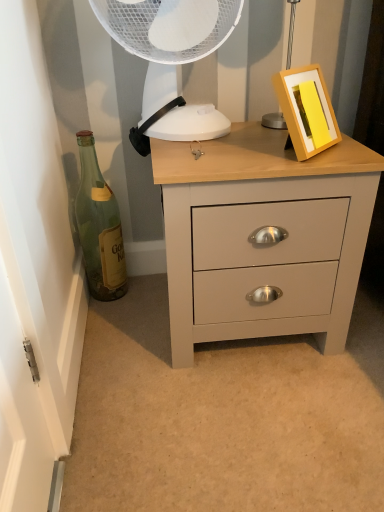
Describe the element at coordinates (259, 227) in the screenshot. Image resolution: width=384 pixels, height=512 pixels. I see `matte gray chest of drawers at center` at that location.

The image size is (384, 512). Describe the element at coordinates (99, 227) in the screenshot. I see `green glass bottle at left` at that location.

The image size is (384, 512). What are the coordinates of `white plastic mechanical fan at upper center` in the screenshot? It's located at (167, 37).

Can we say green glass bottle at left lies outside white plastic mechanical fan at upper center?

Yes, green glass bottle at left is outside of white plastic mechanical fan at upper center.

In the scene shown: Does green glass bottle at left lie behind white plastic mechanical fan at upper center?

Yes, green glass bottle at left is behind white plastic mechanical fan at upper center.

Can you tell me how much green glass bottle at left and white plastic mechanical fan at upper center differ in facing direction?

0.362 degrees.

Based on the photo, which is more to the left, green glass bottle at left or white plastic mechanical fan at upper center?

From the viewer's perspective, green glass bottle at left appears more on the left side.

Is matte gray chest of drawers at center smaller than white plastic mechanical fan at upper center?

Incorrect, matte gray chest of drawers at center is not smaller in size than white plastic mechanical fan at upper center.

The height and width of the screenshot is (512, 384). What are the coordinates of `chest of drawers located on the right of white plastic mechanical fan at upper center` in the screenshot? It's located at (259, 227).

Can you confirm if matte gray chest of drawers at center is shorter than white plastic mechanical fan at upper center?

No, matte gray chest of drawers at center is not shorter than white plastic mechanical fan at upper center.

Consider the image. Which is farther, (x=328, y=212) or (x=222, y=10)?

The point (x=222, y=10) is farther.

In order to click on bottle to the left of matte gray chest of drawers at center in this screenshot , I will do `click(99, 227)`.

From a real-world perspective, relative to green glass bottle at left, is matte gray chest of drawers at center vertically above or below?

matte gray chest of drawers at center is situated lower than green glass bottle at left in the real world.

Consider the image. Is matte gray chest of drawers at center inside the boundaries of green glass bottle at left, or outside?

The correct answer is: outside.

Looking at this image, does green glass bottle at left have a larger size compared to matte gray chest of drawers at center?

No, green glass bottle at left is not bigger than matte gray chest of drawers at center.

In the image, is green glass bottle at left on the left side or the right side of matte gray chest of drawers at center?

Based on their positions, green glass bottle at left is located to the left of matte gray chest of drawers at center.

Which object is further away from the camera, green glass bottle at left or matte gray chest of drawers at center?

green glass bottle at left is further from the camera.

Is point (100, 274) farther from viewer compared to point (204, 204)?

Yes, point (100, 274) is farther from viewer.

Could matte gray chest of drawers at center be considered to be inside white plastic mechanical fan at upper center?

No, matte gray chest of drawers at center is located outside of white plastic mechanical fan at upper center.

Can you confirm if white plastic mechanical fan at upper center is smaller than matte gray chest of drawers at center?

Yes, white plastic mechanical fan at upper center is smaller than matte gray chest of drawers at center.

Who is taller, white plastic mechanical fan at upper center or matte gray chest of drawers at center?

With more height is matte gray chest of drawers at center.

Considering the relative positions of white plastic mechanical fan at upper center and matte gray chest of drawers at center in the image provided, is white plastic mechanical fan at upper center to the right of matte gray chest of drawers at center from the viewer's perspective?

Incorrect, white plastic mechanical fan at upper center is not on the right side of matte gray chest of drawers at center.

Is green glass bottle at left surrounded by white plastic mechanical fan at upper center?

Actually, green glass bottle at left is outside white plastic mechanical fan at upper center.

Between white plastic mechanical fan at upper center and green glass bottle at left, which one has smaller width?

green glass bottle at left.

Between white plastic mechanical fan at upper center and green glass bottle at left, which one has smaller size?

With smaller size is green glass bottle at left.

Considering the positions of point (184, 42) and point (90, 162), is point (184, 42) closer or farther from the camera than point (90, 162)?

Point (184, 42).

Locate an element on the screen. The width and height of the screenshot is (384, 512). mechanical fan in front of the green glass bottle at left is located at coordinates (167, 37).

The width and height of the screenshot is (384, 512). In order to click on mechanical fan located above the matte gray chest of drawers at center (from the image's perspective) in this screenshot , I will do `click(167, 37)`.

Considering their positions, is matte gray chest of drawers at center positioned further to white plastic mechanical fan at upper center than green glass bottle at left?

Based on the image, green glass bottle at left appears to be further to white plastic mechanical fan at upper center.

Estimate the real-world distances between objects in this image. Which object is closer to green glass bottle at left, matte gray chest of drawers at center or white plastic mechanical fan at upper center?

white plastic mechanical fan at upper center is closer to green glass bottle at left.

Which object lies further to the anchor point green glass bottle at left, white plastic mechanical fan at upper center or matte gray chest of drawers at center?

matte gray chest of drawers at center.

From the image, which object appears to be nearer to white plastic mechanical fan at upper center, green glass bottle at left or matte gray chest of drawers at center?

The object closer to white plastic mechanical fan at upper center is matte gray chest of drawers at center.

Which object lies nearer to the anchor point matte gray chest of drawers at center, green glass bottle at left or white plastic mechanical fan at upper center?

white plastic mechanical fan at upper center lies closer to matte gray chest of drawers at center than the other object.

Looking at the image, which one is located closer to matte gray chest of drawers at center, white plastic mechanical fan at upper center or green glass bottle at left?

Among the two, white plastic mechanical fan at upper center is located nearer to matte gray chest of drawers at center.

This screenshot has height=512, width=384. Find the location of `bottle between white plastic mechanical fan at upper center and matte gray chest of drawers at center in the up-down direction`. bottle between white plastic mechanical fan at upper center and matte gray chest of drawers at center in the up-down direction is located at coordinates (99, 227).